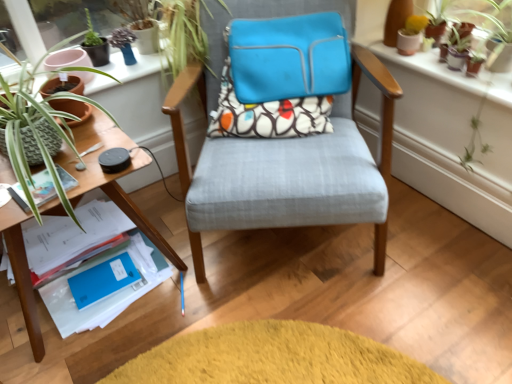
Find the location of a particular element. Image resolution: width=512 pixels, height=384 pixels. free space between wooden table at left and textured fabric chair at center, marked as the second chair in a back-to-front arrangement is located at coordinates (182, 282).